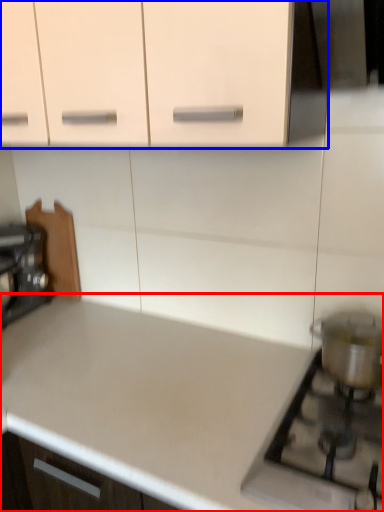
Question: Which object appears farthest to the camera in this image, countertop (highlighted by a red box) or cabinetry (highlighted by a blue box)?

Choices:
 (A) countertop
 (B) cabinetry

Answer: (B)